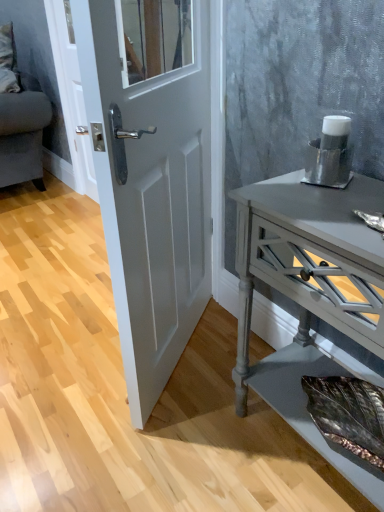
Identify the location of vacant space situated on the left part of white glossy door at center. This screenshot has width=384, height=512. (64, 351).